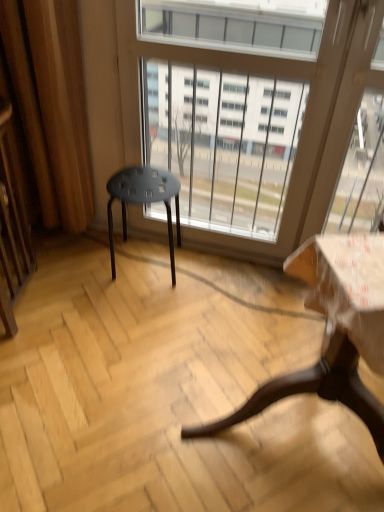
What do you see at coordinates (144, 201) in the screenshot? The height and width of the screenshot is (512, 384). I see `matte black stool at center` at bounding box center [144, 201].

In order to face wooden table at lower right, should I rotate leftwards or rightwards?

It's best to rotate right around 16.261 degrees.

Measure the distance between wooden table at lower right and camera.

They are 37.02 inches apart.

You are a GUI agent. You are given a task and a screenshot of the screen. Output one action in this format:
    pyautogui.click(x=<x>, y=<y>)
    Task: Click on the transparent glass window at center
    
    Given the screenshot: What is the action you would take?
    pyautogui.click(x=304, y=120)

What is the approximate height of transparent glass window at center?

transparent glass window at center is 3.83 feet tall.

What do you see at coordinates (12, 228) in the screenshot? I see `wooden screen door at left` at bounding box center [12, 228].

Identify the location of matte black stool at center. The image size is (384, 512). (144, 201).

Would you say transparent glass window at center is inside or outside matte black stool at center?

transparent glass window at center lies outside matte black stool at center.

From the image's perspective, is transparent glass window at center on matte black stool at center?

Indeed, from the image's perspective, transparent glass window at center is shown above matte black stool at center.

Is the depth of transparent glass window at center greater than that of matte black stool at center?

Answer: No, transparent glass window at center is closer to the viewer.

From a real-world perspective, which object stands above the other?

transparent glass window at center.

Which of these two, wooden screen door at left or matte black stool at center, is bigger?

Bigger between the two is wooden screen door at left.

How many degrees apart are the facing directions of wooden screen door at left and matte black stool at center?

wooden screen door at left and matte black stool at center are facing 0.00067 degrees away from each other.

Is wooden screen door at left placed right next to matte black stool at center?

No, wooden screen door at left is not beside matte black stool at center.

Does point (32, 271) come behind point (121, 172)?

That is True.

In terms of height, does matte black stool at center look taller or shorter compared to transparent glass window at center?

Considering their sizes, matte black stool at center has less height than transparent glass window at center.

Measure the distance between matte black stool at center and transparent glass window at center.

matte black stool at center and transparent glass window at center are 14.38 inches apart.

Is matte black stool at center looking in the opposite direction of transparent glass window at center?

That's right, matte black stool at center is facing away from transparent glass window at center.

Locate an element on the screen. This screenshot has width=384, height=512. window above the wooden table at lower right (from a real-world perspective) is located at coordinates (304, 120).

From a real-world perspective, relative to wooden table at lower right, is transparent glass window at center vertically above or below?

In terms of real-world spatial position, transparent glass window at center is above wooden table at lower right.

Is transparent glass window at center taller or shorter than wooden table at lower right?

In the image, transparent glass window at center appears to be taller than wooden table at lower right.

Based on the photo, is wooden screen door at left completely or partially outside of wooden table at lower right?

Yes, wooden screen door at left is located beyond the bounds of wooden table at lower right.

From a real-world perspective, is wooden screen door at left positioned under wooden table at lower right based on gravity?

Incorrect, from a real-world perspective, wooden screen door at left is higher than wooden table at lower right.

Considering the relative positions of wooden screen door at left and wooden table at lower right in the image provided, is wooden screen door at left to the left or to the right of wooden table at lower right?

wooden screen door at left is to the left of wooden table at lower right.

Considering the points (25, 217) and (205, 435), which point is behind, point (25, 217) or point (205, 435)?

Point (25, 217)

In the scene shown: Which object is thinner, transparent glass window at center or wooden screen door at left?

With smaller width is transparent glass window at center.

Can you confirm if transparent glass window at center is positioned to the right of wooden screen door at left?

Correct, you'll find transparent glass window at center to the right of wooden screen door at left.

At what (x,y) coordinates should I click in order to perform the action: click on window above the wooden screen door at left (from the image's perspective). Please return your answer as a coordinate pair (x, y). The height and width of the screenshot is (512, 384). Looking at the image, I should click on (304, 120).

Is the surface of transparent glass window at center in direct contact with wooden screen door at left?

transparent glass window at center and wooden screen door at left are clearly separated.

Is wooden screen door at left with transparent glass window at center?

Answer: wooden screen door at left and transparent glass window at center are clearly separated.

Is wooden screen door at left to the left or to the right of transparent glass window at center in the image?

In the image, wooden screen door at left appears on the left side of transparent glass window at center.

Can transparent glass window at center be found inside wooden screen door at left?

Actually, transparent glass window at center is outside wooden screen door at left.

Where is `window that appears above the matte black stool at center (from a real-world perspective)`? window that appears above the matte black stool at center (from a real-world perspective) is located at coordinates (304, 120).

Where is `stool that appears below the wooden screen door at left (from the image's perspective)`? The height and width of the screenshot is (512, 384). stool that appears below the wooden screen door at left (from the image's perspective) is located at coordinates (144, 201).

Which object lies further to the anchor point wooden screen door at left, wooden table at lower right or matte black stool at center?

Based on the image, wooden table at lower right appears to be further to wooden screen door at left.

Based on their spatial positions, is matte black stool at center or wooden screen door at left closer to wooden table at lower right?

matte black stool at center.

Considering their positions, is wooden screen door at left positioned closer to transparent glass window at center than wooden table at lower right?

Based on the image, wooden table at lower right appears to be nearer to transparent glass window at center.

When comparing their distances from matte black stool at center, does transparent glass window at center or wooden screen door at left seem further?

wooden screen door at left is positioned further to the anchor matte black stool at center.

When comparing their distances from transparent glass window at center, does wooden table at lower right or wooden screen door at left seem further?

Based on the image, wooden screen door at left appears to be further to transparent glass window at center.

Which object lies further to the anchor point matte black stool at center, wooden table at lower right or wooden screen door at left?

Based on the image, wooden table at lower right appears to be further to matte black stool at center.

Considering their positions, is wooden screen door at left positioned closer to wooden table at lower right than matte black stool at center?

matte black stool at center.

Considering their positions, is wooden screen door at left positioned further to transparent glass window at center than matte black stool at center?

The object further to transparent glass window at center is wooden screen door at left.

What are the coordinates of `stool between wooden screen door at left and transparent glass window at center in the horizontal direction` in the screenshot? It's located at (144, 201).

Find the location of a particular element. The height and width of the screenshot is (512, 384). window located between wooden screen door at left and wooden table at lower right in the left-right direction is located at coordinates (304, 120).

You are a GUI agent. You are given a task and a screenshot of the screen. Output one action in this format:
    pyautogui.click(x=<x>, y=<y>)
    Task: Click on the stool located between wooden screen door at left and wooden table at lower right in the left-right direction
    
    Given the screenshot: What is the action you would take?
    pyautogui.click(x=144, y=201)

Find the location of a particular element. This screenshot has width=384, height=512. window positioned between wooden table at lower right and matte black stool at center from near to far is located at coordinates (304, 120).